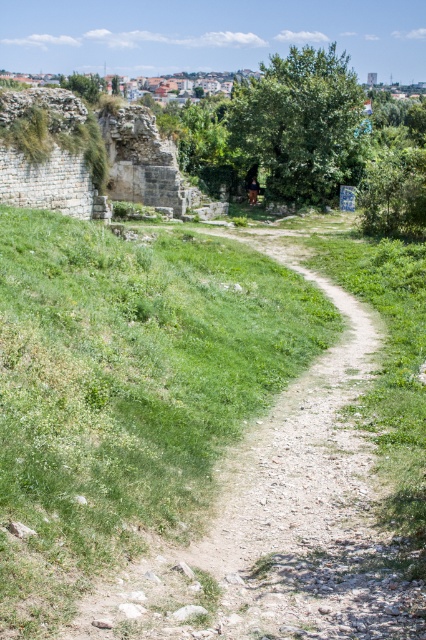
Question: In this image, where is green grassy at center located relative to brown leather jacket at center?

Choices:
 (A) right
 (B) left

Answer: (B)

Question: Is green grassy at center further to camera compared to brown leather jacket at center?

Choices:
 (A) yes
 (B) no

Answer: (B)

Question: Is green grassy at center thinner than brown leather jacket at center?

Choices:
 (A) no
 (B) yes

Answer: (A)

Question: Which object is farther from the camera taking this photo?

Choices:
 (A) green grassy at center
 (B) brown leather jacket at center

Answer: (B)

Question: Which of the following is the farthest from the observer?

Choices:
 (A) brown leather jacket at center
 (B) green grassy at center

Answer: (A)